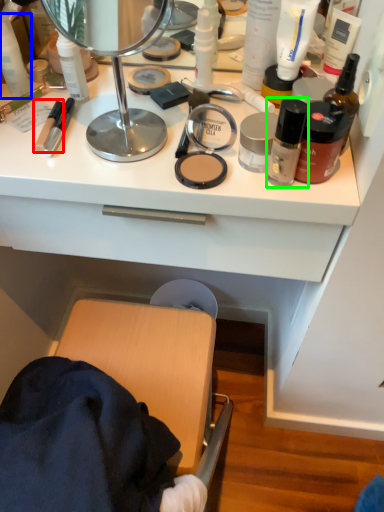
Question: Based on their relative distances, which object is nearer to toiletry (highlighted by a red box)? Choose from toiletry (highlighted by a blue box) and toiletry (highlighted by a green box).

Choices:
 (A) toiletry
 (B) toiletry

Answer: (A)